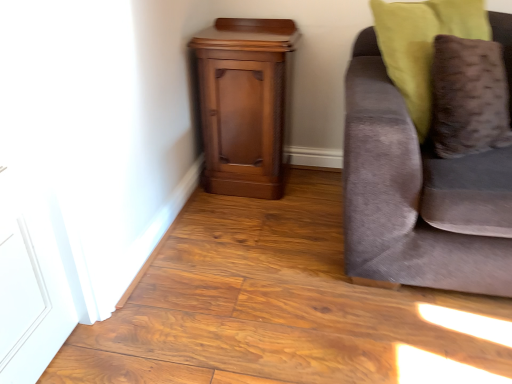
Locate an element on the screen. The image size is (512, 384). free spot to the left of velvet gray couch at right is located at coordinates (251, 260).